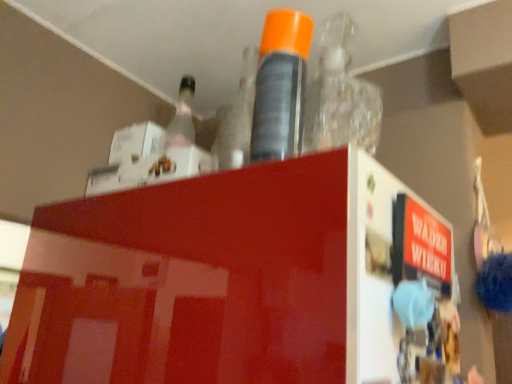
Question: From a real-world perspective, is transparent plastic bottle at upper center, which appears as the 3th bottle when viewed from the left, positioned over orange cap spray can at center, the second bottle positioned from the left, based on gravity?

Choices:
 (A) yes
 (B) no

Answer: (A)

Question: Is transparent plastic bottle at upper center, which appears as the 3th bottle when viewed from the left, positioned before orange cap spray can at center, which is the second bottle from right to left?

Choices:
 (A) yes
 (B) no

Answer: (B)

Question: From the image's perspective, would you say transparent plastic bottle at upper center, which appears as the 3th bottle when viewed from the left, is shown under orange cap spray can at center, which is the second bottle from right to left?

Choices:
 (A) yes
 (B) no

Answer: (A)

Question: From a real-world perspective, does transparent plastic bottle at upper center, which is the first bottle in right-to-left order, sit lower than orange cap spray can at center, the second bottle positioned from the left?

Choices:
 (A) no
 (B) yes

Answer: (A)

Question: Does transparent plastic bottle at upper center, which is the first bottle in right-to-left order, appear on the left side of orange cap spray can at center, the second bottle positioned from the left?

Choices:
 (A) yes
 (B) no

Answer: (B)

Question: Is transparent plastic bottle at upper center, which is the first bottle in right-to-left order, outside orange cap spray can at center, which is the second bottle from right to left?

Choices:
 (A) yes
 (B) no

Answer: (A)

Question: From a real-world perspective, is clear plastic bottle at upper center, which is the first bottle from left to right, on top of transparent plastic bottle at upper center, which appears as the 3th bottle when viewed from the left?

Choices:
 (A) no
 (B) yes

Answer: (A)

Question: Is clear plastic bottle at upper center, which is the first bottle from left to right, bigger than transparent plastic bottle at upper center, which appears as the 3th bottle when viewed from the left?

Choices:
 (A) no
 (B) yes

Answer: (A)

Question: Is the depth of clear plastic bottle at upper center, the third bottle when ordered from right to left, less than that of transparent plastic bottle at upper center, which is the first bottle in right-to-left order?

Choices:
 (A) yes
 (B) no

Answer: (B)

Question: Considering the relative sizes of clear plastic bottle at upper center, the third bottle when ordered from right to left, and transparent plastic bottle at upper center, which is the first bottle in right-to-left order, in the image provided, is clear plastic bottle at upper center, the third bottle when ordered from right to left, thinner than transparent plastic bottle at upper center, which is the first bottle in right-to-left order,?

Choices:
 (A) yes
 (B) no

Answer: (A)

Question: Considering the relative sizes of clear plastic bottle at upper center, which is the first bottle from left to right, and transparent plastic bottle at upper center, which appears as the 3th bottle when viewed from the left, in the image provided, is clear plastic bottle at upper center, which is the first bottle from left to right, smaller than transparent plastic bottle at upper center, which appears as the 3th bottle when viewed from the left,?

Choices:
 (A) yes
 (B) no

Answer: (A)

Question: Could you tell me if clear plastic bottle at upper center, which is the first bottle from left to right, is turned towards transparent plastic bottle at upper center, which appears as the 3th bottle when viewed from the left?

Choices:
 (A) yes
 (B) no

Answer: (B)

Question: Is orange cap spray can at center, the second bottle positioned from the left, thinner than transparent plastic bottle at upper center, which appears as the 3th bottle when viewed from the left?

Choices:
 (A) yes
 (B) no

Answer: (A)